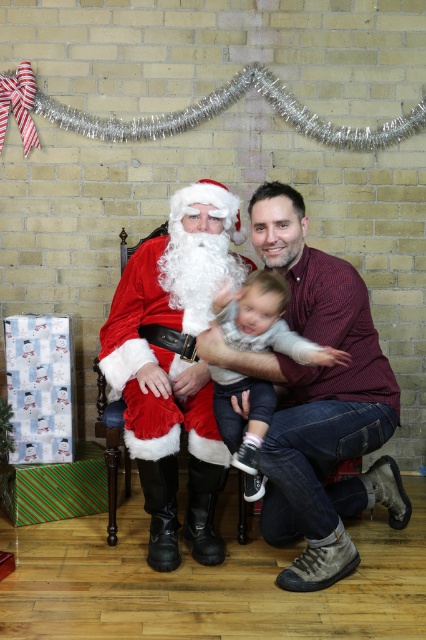
Question: Considering the relative positions of matte red shirt at center and soft gray sweater at center in the image provided, where is matte red shirt at center located with respect to soft gray sweater at center?

Choices:
 (A) left
 (B) right

Answer: (B)

Question: Which object is positioned closest to the fuzzy red santa at left?

Choices:
 (A) soft gray sweater at center
 (B) matte red shirt at center

Answer: (A)

Question: Which of the following is the closest to the observer?

Choices:
 (A) (374, 464)
 (B) (264, 326)

Answer: (B)

Question: Is matte red shirt at center closer to camera compared to fuzzy red santa at left?

Choices:
 (A) yes
 (B) no

Answer: (A)

Question: Where is fuzzy red santa at left located in relation to soft gray sweater at center in the image?

Choices:
 (A) right
 (B) left

Answer: (B)

Question: Which of the following is the closest to the observer?

Choices:
 (A) (118, 301)
 (B) (301, 362)
 (C) (307, 460)

Answer: (B)